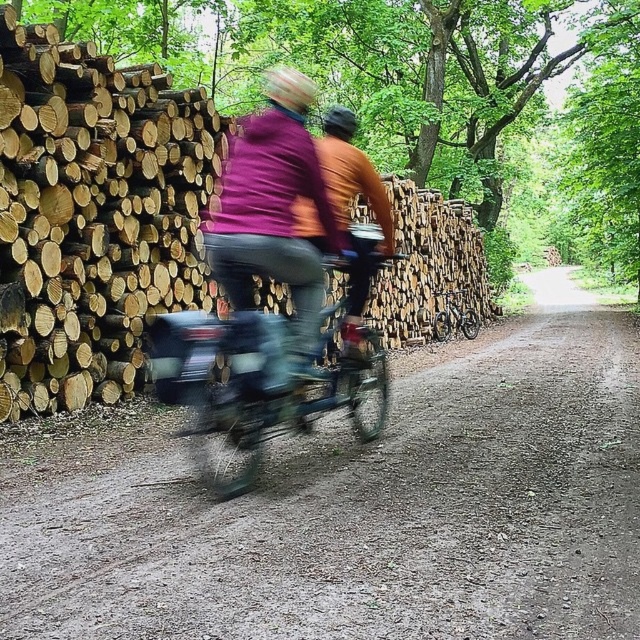
You are a cyclist planning to ride through the dirt track at center and the natural wood logs at left. Which path is wider?

The dirt track at center is wider than natural wood logs at left according to the description.

Consider the image. You are planning to ride a metallic blue bicycle at center through a narrow forest path. The path is just wide enough to allow the bicycle to pass. If you also wear a matte purple jacket at center, will the jacket affect the bicycle width needed to pass?

The metallic blue bicycle at center is wider than the matte purple jacket at center. Since the path is already wide enough for the bicycle, the jacket won

You are standing at the starting point of the dirt path in the forest. You see two points marked on the path ahead of you. The first point is at coordinates point (214, 563) and the second point is at coordinates point (22, 134). Which point is closer to you?

Point (214, 563) is closer to the viewer than point (22, 134).